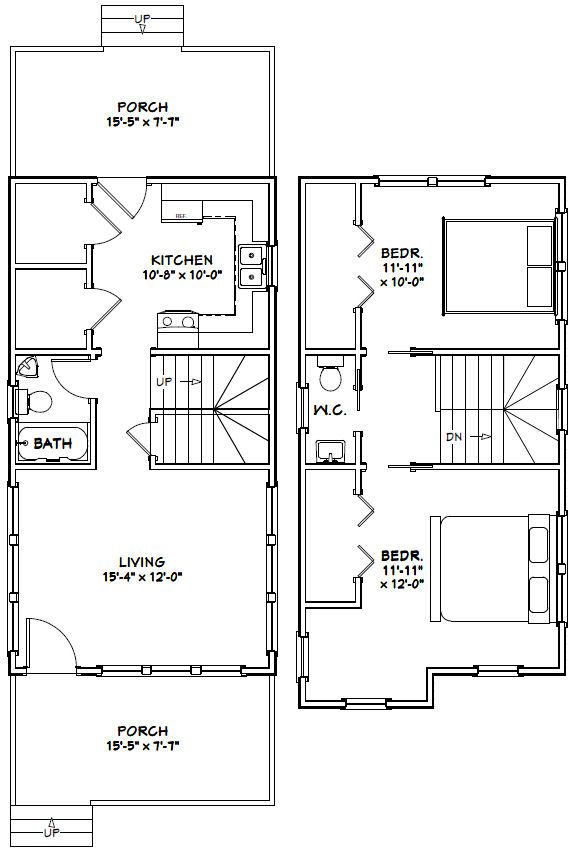
Locate an element on the screen. The image size is (575, 856). representation of stairs is located at coordinates (38, 823), (198, 411), (489, 417), (137, 24).